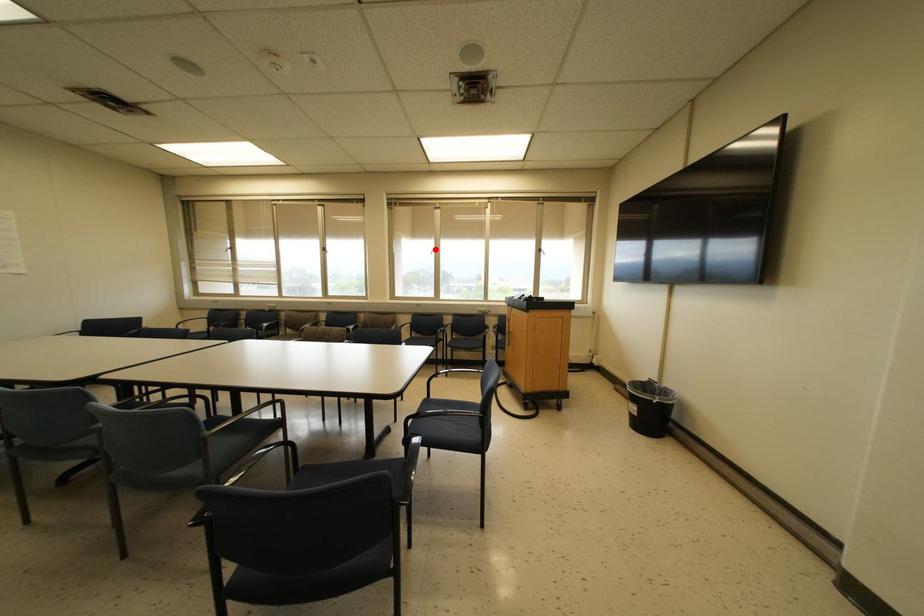
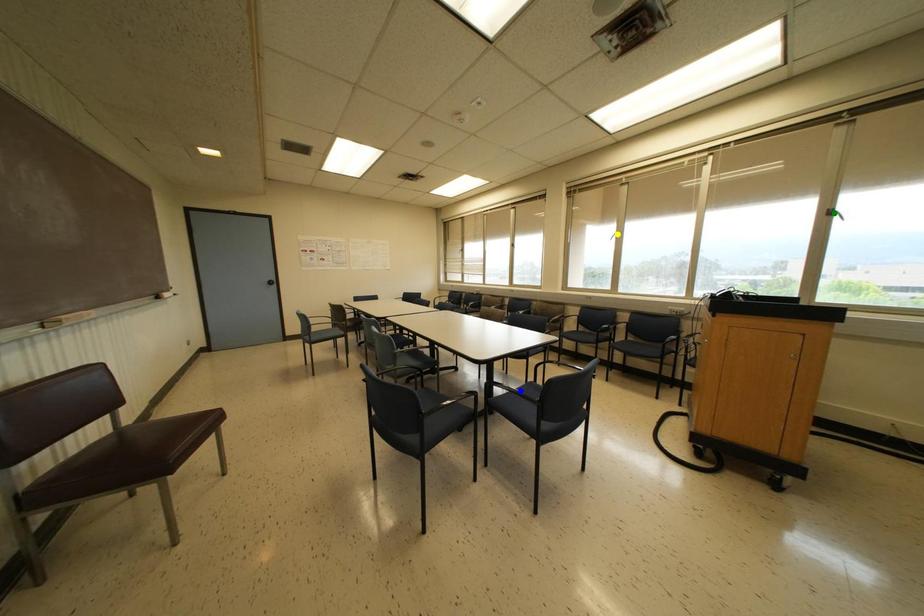
Question: I am providing you with two images of the same scene from different viewpoints. A red point is marked on the first image. You are given multiple points on the second image. Which spot in image 2 lines up with the point in image 1?

Choices:
 (A) blue point
 (B) yellow point
 (C) green point

Answer: (B)